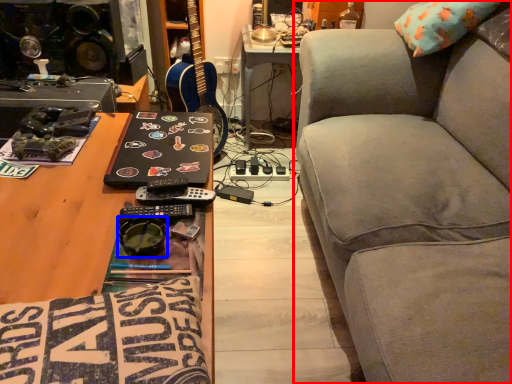
Question: Which point is further to the camera, studio couch (highlighted by a red box) or goggles (highlighted by a blue box)?

Choices:
 (A) studio couch
 (B) goggles

Answer: (B)